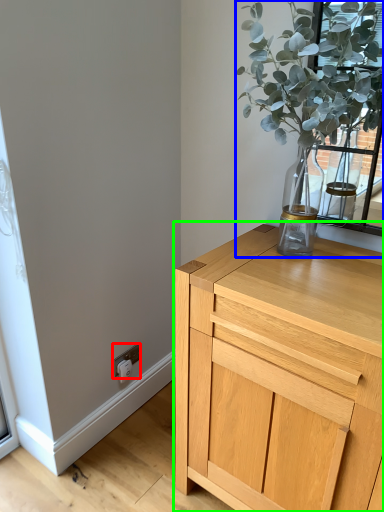
Question: Estimate the real-world distances between objects in this image. Which object is closer to electric outlet (highlighted by a red box), houseplant (highlighted by a blue box) or chest of drawers (highlighted by a green box)?

Choices:
 (A) houseplant
 (B) chest of drawers

Answer: (B)